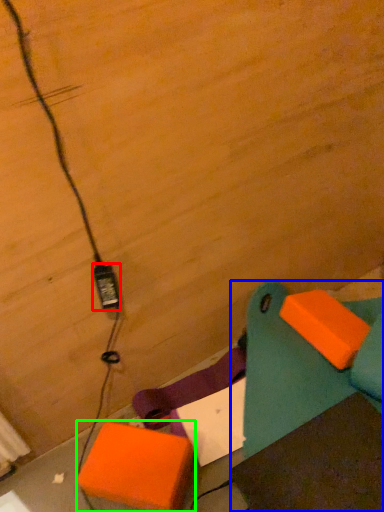
Question: Estimate the real-world distances between objects in this image. Which object is closer to power plugs and sockets (highlighted by a red box), furniture (highlighted by a blue box) or cardboard box (highlighted by a green box)?

Choices:
 (A) furniture
 (B) cardboard box

Answer: (B)